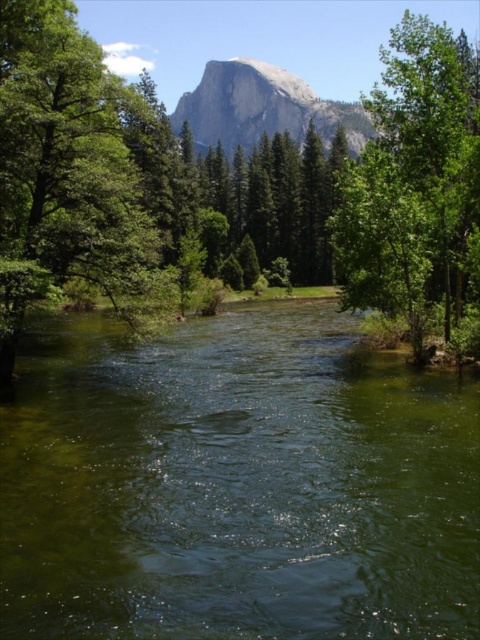
Does green liquid water at center have a lesser width compared to granite rock formation at upper center?

Yes.

Between point (71, 556) and point (335, 108), which one is positioned behind?

The point (335, 108) is behind.

Where is `green liquid water at center`? The height and width of the screenshot is (640, 480). green liquid water at center is located at coordinates (236, 486).

At what (x,y) coordinates should I click in order to perform the action: click on green liquid water at center. Please return your answer as a coordinate pair (x, y). Looking at the image, I should click on (236, 486).

Looking at this image, between green liquid water at center and green leafy tree at right, which one is positioned higher?

green leafy tree at right is above.

Between point (410, 371) and point (477, 202), which one is positioned in front?

Positioned in front is point (477, 202).

Where is `green liquid water at center`? Image resolution: width=480 pixels, height=640 pixels. green liquid water at center is located at coordinates coord(236,486).

Which is above, green leafy tree at right or granite rock formation at upper center?

green leafy tree at right is higher up.

Who is more forward, (402, 225) or (268, 67)?

Point (402, 225)

This screenshot has width=480, height=640. Find the location of `green leafy tree at right`. green leafy tree at right is located at coordinates (412, 182).

I want to click on green leafy tree at right, so click(412, 182).